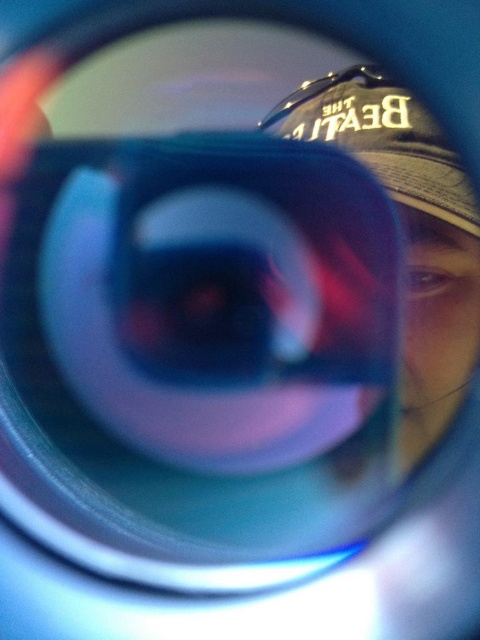
Question: Is transparent plastic magnifying glass at center to the right of matte black baseball cap at upper right from the viewer's perspective?

Choices:
 (A) no
 (B) yes

Answer: (A)

Question: Does transparent plastic magnifying glass at center have a smaller size compared to matte black baseball cap at upper right?

Choices:
 (A) no
 (B) yes

Answer: (A)

Question: Can you confirm if transparent plastic magnifying glass at center is smaller than matte black baseball cap at upper right?

Choices:
 (A) yes
 (B) no

Answer: (B)

Question: Which point is closer to the camera?

Choices:
 (A) transparent plastic magnifying glass at center
 (B) matte black baseball cap at upper right

Answer: (A)

Question: Among these objects, which one is nearest to the camera?

Choices:
 (A) matte black baseball cap at upper right
 (B) transparent plastic magnifying glass at center

Answer: (B)